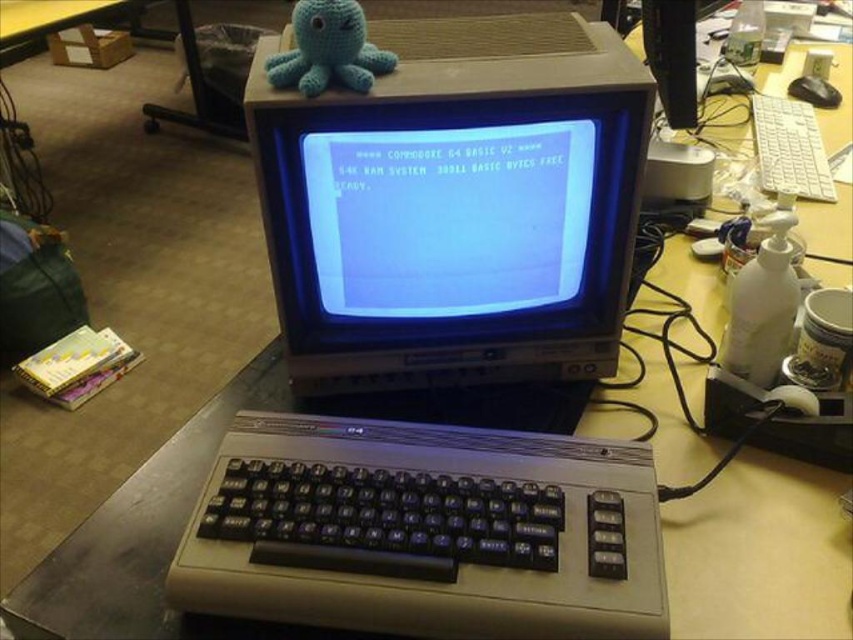
You are organizing cables for the vintage computer setup. You need to plug a new USB cable into the matte plastic monitor at center and the black plastic mouse at upper right. Which device should you plug the USB cable into first if you want to ensure the cable is long enough to reach both without stretching?

The matte plastic monitor at center is in front of the black plastic mouse at upper right, so you should plug the USB cable into the black plastic mouse at upper right first to ensure the cable can reach both devices without stretching.